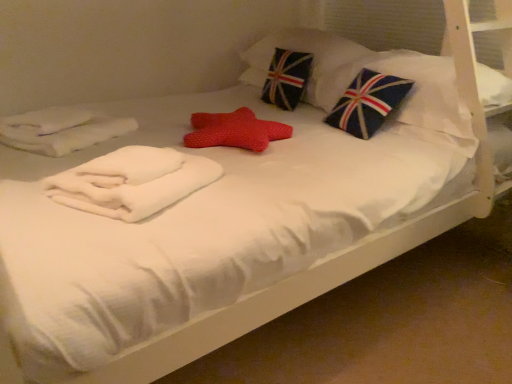
Question: Is point (152, 205) closer or farther from the camera than point (428, 74)?

Choices:
 (A) farther
 (B) closer

Answer: (B)

Question: From a real-world perspective, is white soft towel at center above or below blue fabric pillow with flag design at upper right, which is counted as the 1th pillow, starting from the front?

Choices:
 (A) above
 (B) below

Answer: (B)

Question: Which of these objects is positioned farthest from the blue fabric pillow with flag design at upper right, which is counted as the 1th pillow, starting from the front?

Choices:
 (A) white soft towel at center
 (B) union jack fabric pillow at upper center, which ranks as the 2th pillow in front-to-back order

Answer: (A)

Question: Which of these objects is positioned closest to the blue fabric pillow with flag design at upper right, which is counted as the 1th pillow, starting from the front?

Choices:
 (A) union jack fabric pillow at upper center, which ranks as the 2th pillow in front-to-back order
 (B) white soft towel at center

Answer: (A)